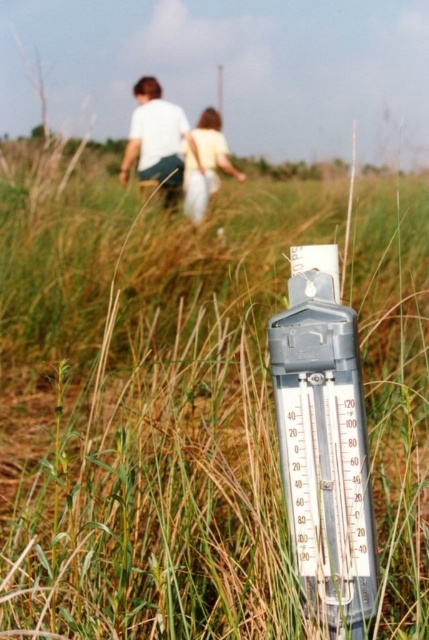
Is white cotton shirt at upper center behind light yellow fabric dress at center?

Yes.

Can you confirm if white cotton shirt at upper center is positioned to the left of light yellow fabric dress at center?

Yes, white cotton shirt at upper center is to the left of light yellow fabric dress at center.

The width and height of the screenshot is (429, 640). I want to click on white cotton shirt at upper center, so click(x=157, y=140).

I want to click on white cotton shirt at upper center, so click(x=157, y=140).